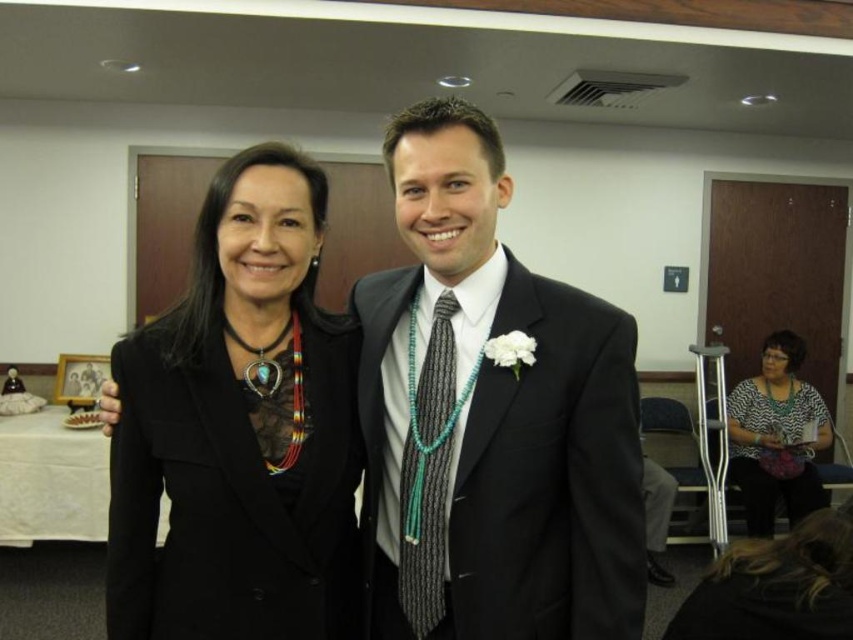
Can you confirm if black leather jacket at left is bigger than printed fabric blouse at lower right?

No.

This screenshot has width=853, height=640. Find the location of `black leather jacket at left`. black leather jacket at left is located at coordinates pyautogui.click(x=239, y=429).

Where is `black leather jacket at left`? black leather jacket at left is located at coordinates (239, 429).

Can you confirm if matte black suit at center is positioned to the right of black leather jacket at left?

Indeed, matte black suit at center is positioned on the right side of black leather jacket at left.

Is point (454, 518) less distant than point (294, 308)?

Yes.

Find the location of a particular element. Image resolution: width=853 pixels, height=640 pixels. matte black suit at center is located at coordinates (492, 417).

Can you confirm if matte black suit at center is positioned below gray textured tie at center?

No, matte black suit at center is not below gray textured tie at center.

Who is more forward, (643, 582) or (457, 307)?

Point (643, 582) is more forward.

Is point (595, 358) closer to camera compared to point (421, 474)?

Yes, it is in front of point (421, 474).

At what (x,y) coordinates should I click in order to perform the action: click on matte black suit at center. Please return your answer as a coordinate pair (x, y). The width and height of the screenshot is (853, 640). Looking at the image, I should click on (492, 417).